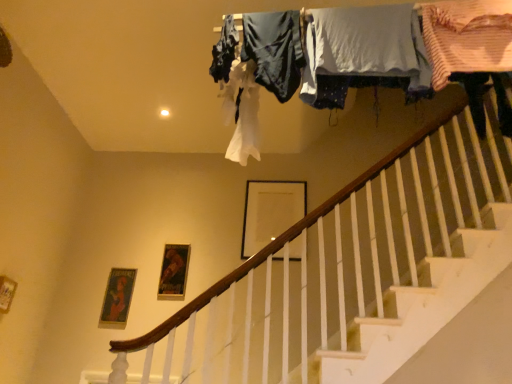
Question: Based on their sizes in the image, would you say white cotton shirt at upper center, which appears as the third clothing when viewed from the left, is bigger or smaller than dark blue fabric at upper center, the first clothing in the left-to-right sequence?

Choices:
 (A) big
 (B) small

Answer: (A)

Question: From the image's perspective, relative to dark blue fabric at upper center, the 4th clothing viewed from the right, is white cotton shirt at upper center, the 2th clothing viewed from the right, above or below?

Choices:
 (A) below
 (B) above

Answer: (A)

Question: Estimate the real-world distances between objects in this image. Which object is closer to the metallic gold picture frame at center, the 2th picture frame positioned from the top?

Choices:
 (A) matte white picture frame at center, positioned as the 1th picture frame in top-to-bottom order
 (B) white cotton shirt at upper center, which appears as the third clothing when viewed from the left
 (C) striped cotton shirt at upper right, which is the 1th clothing in right-to-left order
 (D) silky blue fabric at upper center, arranged as the third clothing when viewed from the right
 (E) dark blue fabric at upper center, the 4th clothing viewed from the right

Answer: (A)

Question: Which is nearer to the metallic gold picture frame at center, the 2th picture frame positioned from the top?

Choices:
 (A) dark blue fabric at upper center, the first clothing in the left-to-right sequence
 (B) striped cotton shirt at upper right, which is the 4th clothing from left to right
 (C) white cotton shirt at upper center, which appears as the third clothing when viewed from the left
 (D) matte white picture frame at center, positioned as the 1th picture frame in top-to-bottom order
 (E) silky blue fabric at upper center, the second clothing in the left-to-right sequence

Answer: (D)